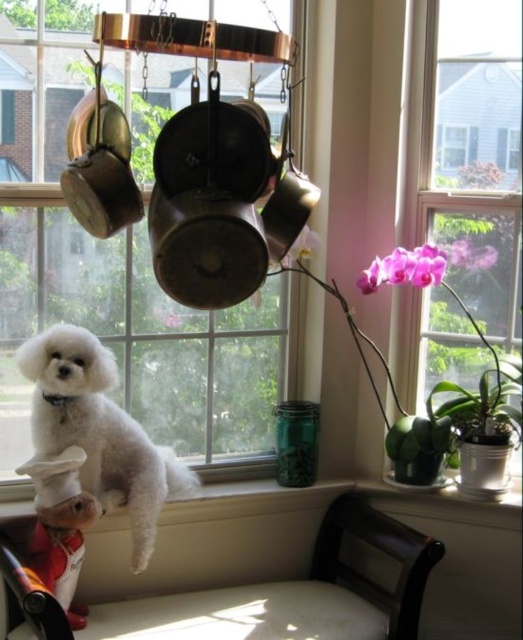
Question: Considering the relative positions of pink orchid at upper right and matte red chef hat at lower left in the image provided, where is pink orchid at upper right located with respect to matte red chef hat at lower left?

Choices:
 (A) right
 (B) left

Answer: (A)

Question: Which point is closer to the camera taking this photo?

Choices:
 (A) (463, 108)
 (B) (185, 344)

Answer: (A)

Question: Is pink orchid at upper right below white fluffy dog at center?

Choices:
 (A) no
 (B) yes

Answer: (A)

Question: From the image, what is the correct spatial relationship of clear glass window at center in relation to matte red chef hat at lower left?

Choices:
 (A) left
 (B) right

Answer: (B)

Question: Among these objects, which one is farthest from the camera?

Choices:
 (A) clear glass window at center
 (B) pink orchid at upper right
 (C) white fluffy dog at center

Answer: (B)

Question: Which is nearer to the pink orchid at upper right?

Choices:
 (A) white fabric chair at lower center
 (B) white fluffy dog at center
 (C) clear glass window at center
 (D) matte red chef hat at lower left

Answer: (C)